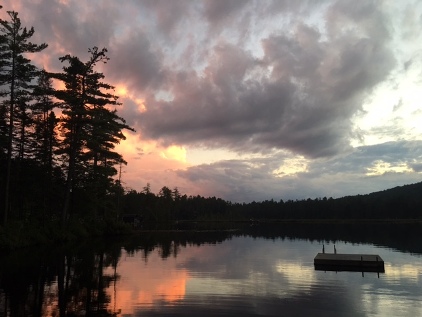
Find the location of a particular element. This screenshot has height=317, width=422. wooden platform is located at coordinates (347, 256).